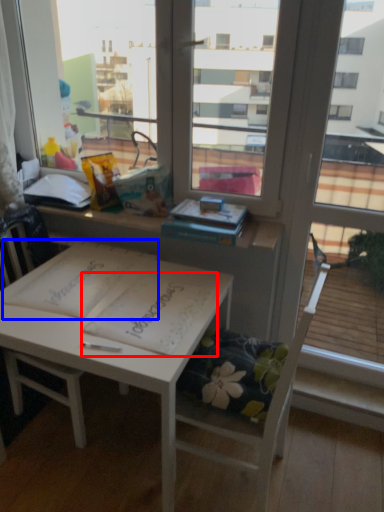
Question: Which object appears farthest to the camera in this image, notebook (highlighted by a red box) or notebook (highlighted by a blue box)?

Choices:
 (A) notebook
 (B) notebook

Answer: (B)